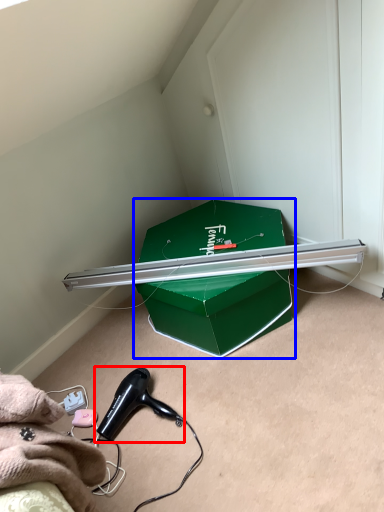
Question: Which object is further to the camera taking this photo, hair drier (highlighted by a red box) or box (highlighted by a blue box)?

Choices:
 (A) hair drier
 (B) box

Answer: (B)